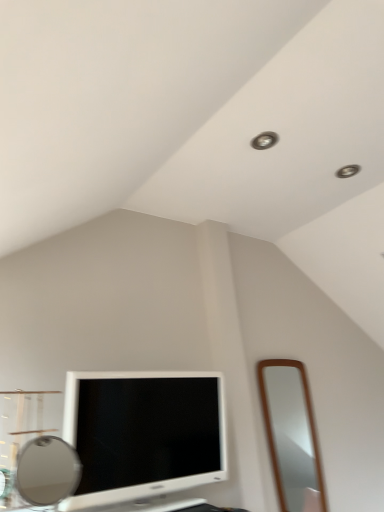
Question: Is matte silver mirror at lower left, the second mirror in the back-to-front sequence, to the left or to the right of white glossy television at lower left in the image?

Choices:
 (A) right
 (B) left

Answer: (B)

Question: In terms of size, does matte silver mirror at lower left, which ranks as the second mirror in right-to-left order, appear bigger or smaller than white glossy television at lower left?

Choices:
 (A) small
 (B) big

Answer: (A)

Question: Which object is the closest to the matte silver mirror at lower left, which is counted as the first mirror, starting from the front?

Choices:
 (A) brown wooden mirror at right, which is counted as the second mirror, starting from the front
 (B) white glossy television at lower left

Answer: (B)

Question: Which is farther from the matte silver mirror at lower left, which is counted as the first mirror, starting from the front?

Choices:
 (A) white glossy television at lower left
 (B) brown wooden mirror at right, acting as the first mirror starting from the back

Answer: (B)